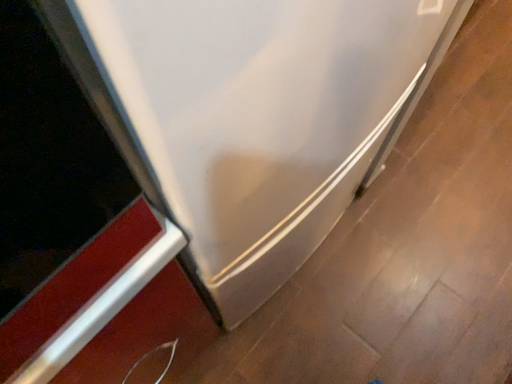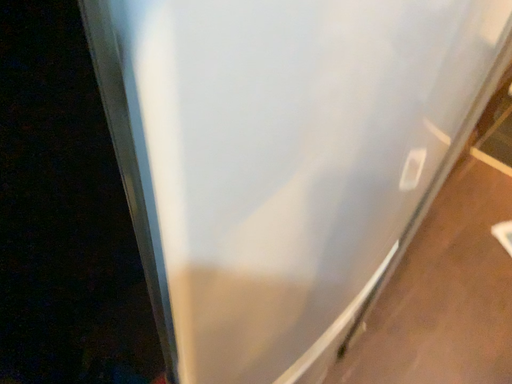
Question: How did the camera likely rotate when shooting the video?

Choices:
 (A) rotated upward
 (B) rotated downward

Answer: (A)